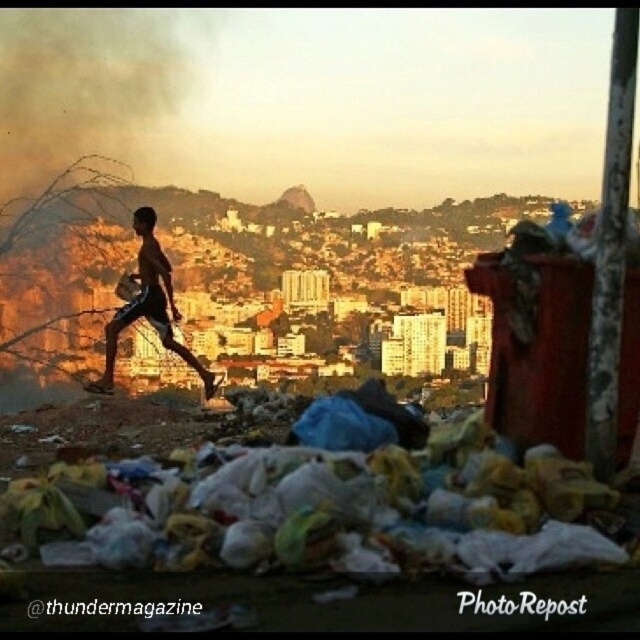
Does plastic bags at lower center lie behind shiny metallic shorts at left?

No, plastic bags at lower center is in front of shiny metallic shorts at left.

Identify the location of plastic bags at lower center. (320, 509).

Is plastic bags at lower center above black smoke at upper left?

No.

How much distance is there between plastic bags at lower center and black smoke at upper left?

They are 227.41 meters apart.

This screenshot has width=640, height=640. In order to click on plastic bags at lower center in this screenshot , I will do `click(320, 509)`.

Find the location of a particular element. Image resolution: width=640 pixels, height=640 pixels. plastic bags at lower center is located at coordinates (320, 509).

Can you confirm if black smoke at upper left is positioned below shiny metallic shorts at left?

No.

Which is in front, point (173, 45) or point (148, 300)?

Point (148, 300) is in front.

What are the coordinates of `black smoke at upper left` in the screenshot? It's located at (76, 99).